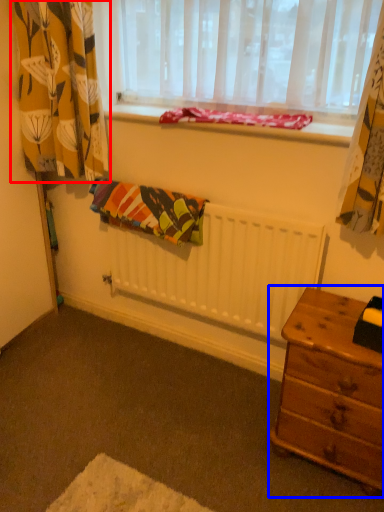
Question: Which object appears closest to the camera in this image, curtain (highlighted by a red box) or nightstand (highlighted by a blue box)?

Choices:
 (A) curtain
 (B) nightstand

Answer: (B)